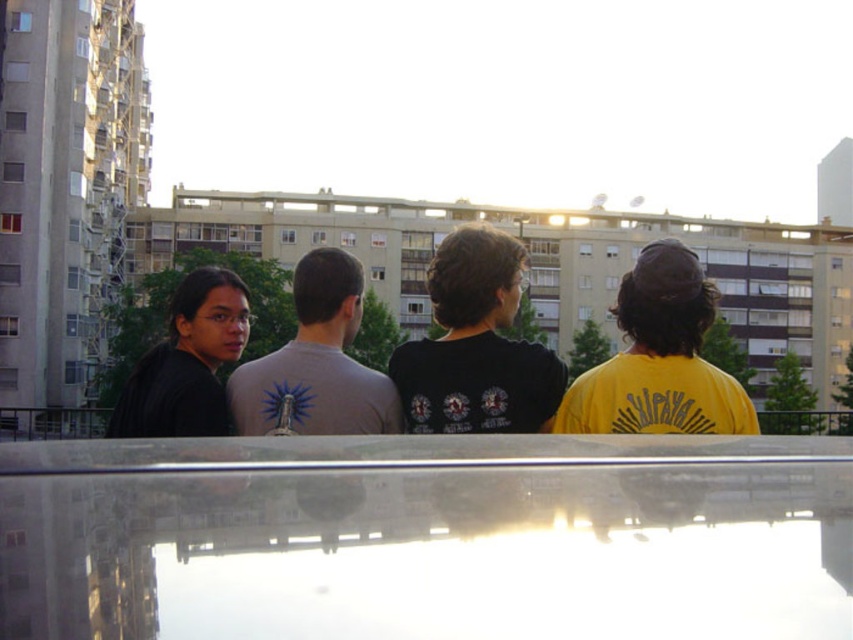
You are a photographer trying to capture a group photo of the yellow matte shirt at upper right and the black matte shirt at left. The camera you are using has a maximum focus range of 3 meters. Will you be able to focus on both subjects simultaneously?

The yellow matte shirt at upper right and black matte shirt at left are 3.19 meters apart from each other. Since the camera can only focus up to 3 meters, the distance between them exceeds the maximum range. Therefore, you cannot focus on both subjects at the same time.

You are a photographer trying to capture a photo of the yellow matte shirt at upper right and the black matte shirt at left. Since the scene has a reflective surface, you want to ensure you capture both shirts in the reflection. Which shirt will appear on the left side of the reflection?

The black matte shirt at left will appear on the left side of the reflection because in reflections, the mirrored image reverses the original positions. Since the yellow matte shirt at upper right is on the right of the black matte shirt at left in reality, its reflection would place the black matte shirt at left on the left side.